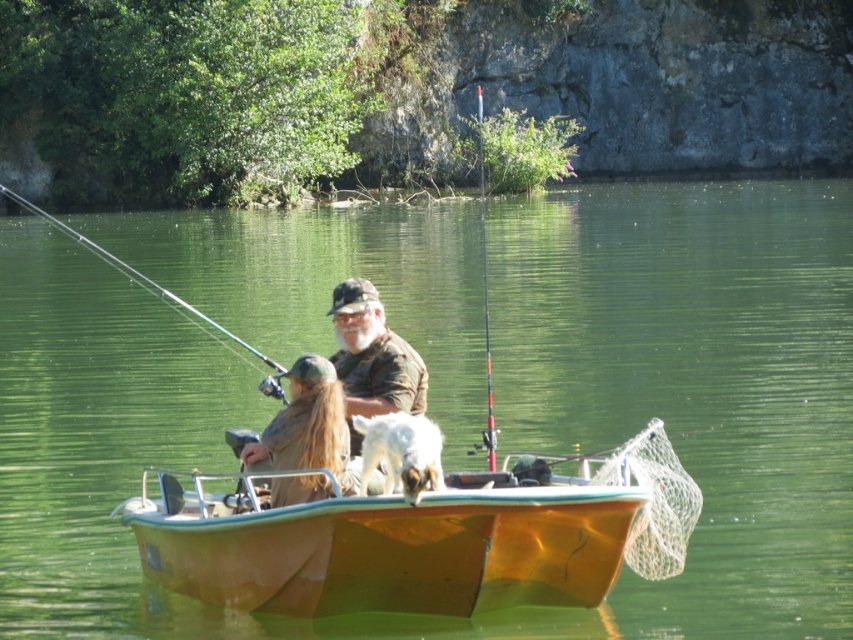
You are an observer standing on the lakeside. You see the green water at center and the orange fiberglass fishing pole at center. Which object is lower in the scene?

The green water at center is below the orange fiberglass fishing pole at center, so the green water at center is lower.